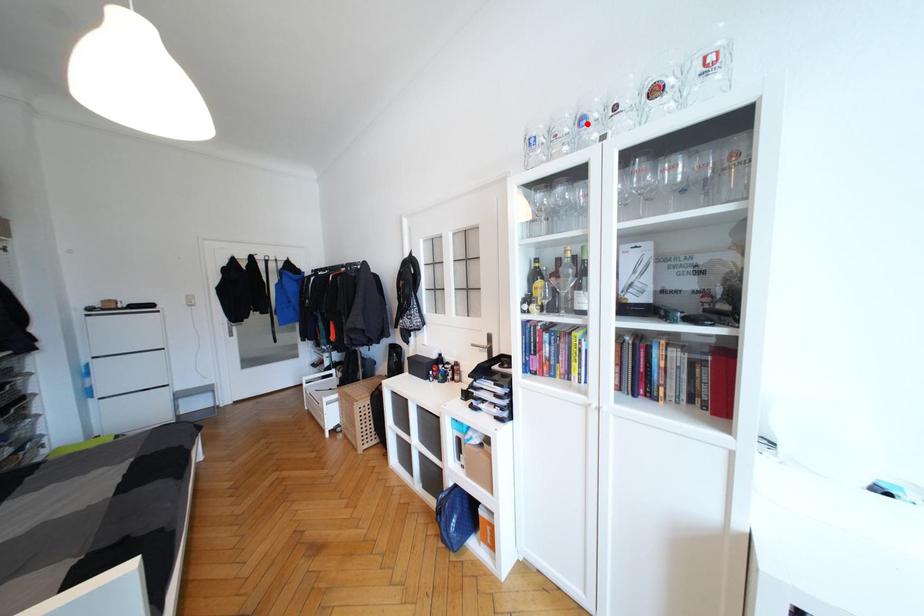
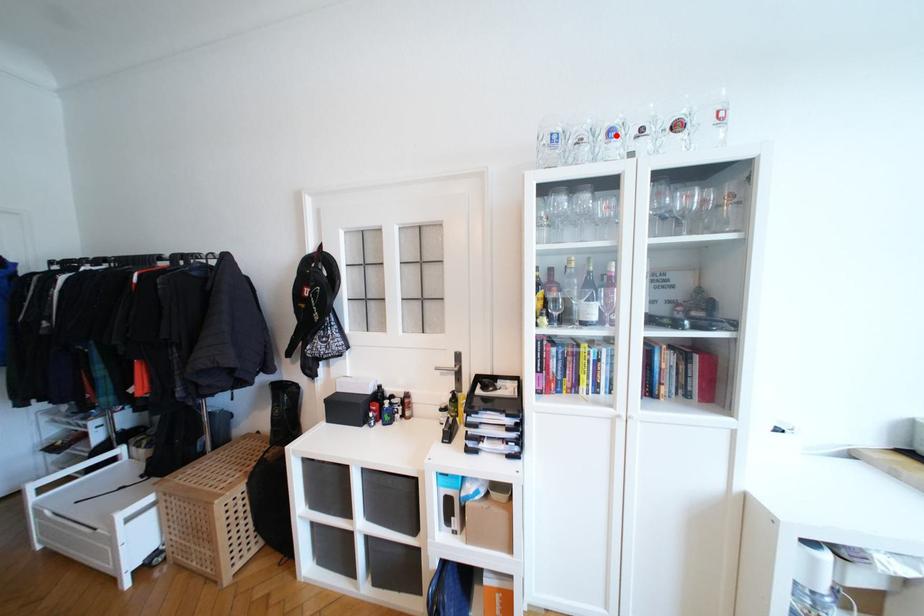
I am providing you with two images of the same scene from different viewpoints. A red point is marked on the first image and another point is marked on the second image. Does the point marked in image1 correspond to the same location as the one in image2?

Yes